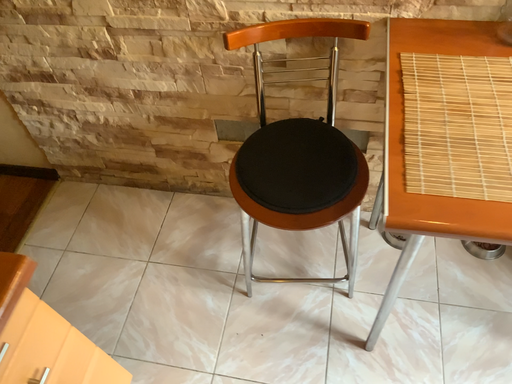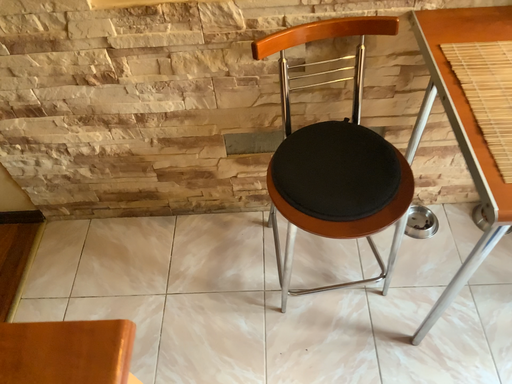
Question: How did the camera likely rotate when shooting the video?

Choices:
 (A) rotated left
 (B) rotated right

Answer: (B)